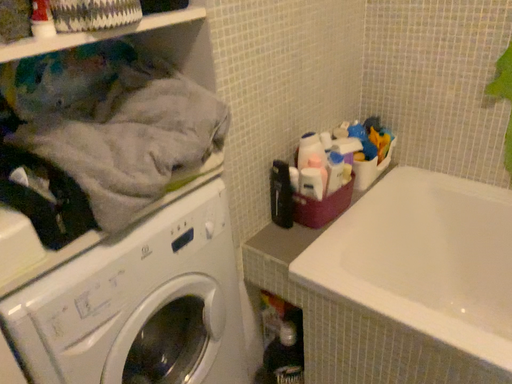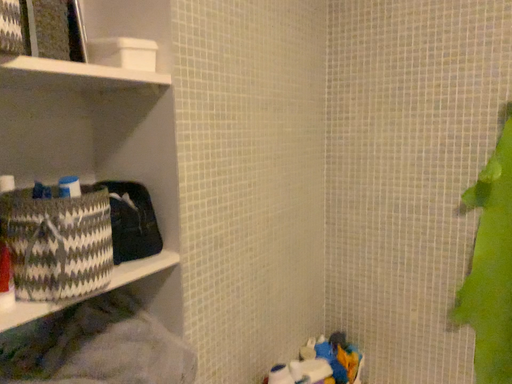
Question: Which way did the camera rotate in the video?

Choices:
 (A) rotated left
 (B) rotated right

Answer: (B)